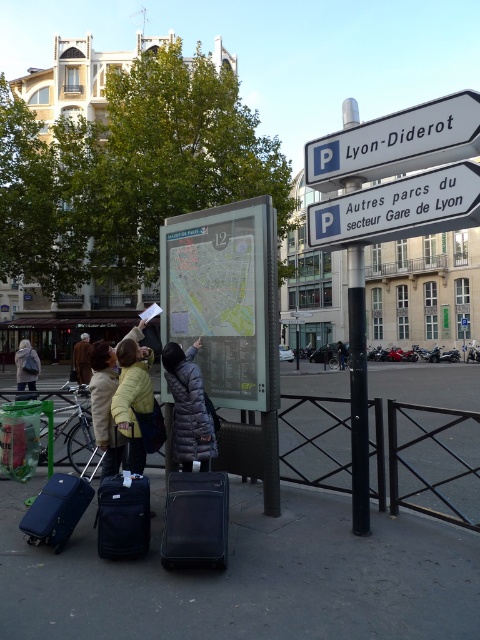
You are a tourist holding a map and need to check the blue plastic parking sign at upper right. Can you walk directly to it from where you are standing in front of the transparent plastic map at center?

The transparent plastic map at center is further to the viewer than blue plastic parking sign at upper right, so you cannot walk directly to the blue plastic parking sign at upper right because it is behind the transparent plastic map at center.

You are a tourist in this city and need to find a parking spot. You see the blue plastic parking sign at upper right and the light brown leather jacket at center. Which object is higher up in the image?

The blue plastic parking sign at upper right is located above the light brown leather jacket at center, so it is higher up in the image.